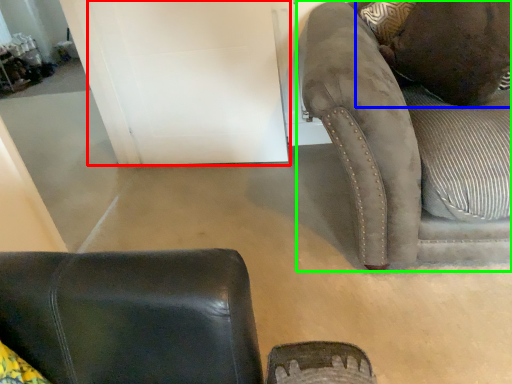
Question: Which object is positioned closest to door (highlighted by a red box)? Select from pillow (highlighted by a blue box) and studio couch (highlighted by a green box).

Choices:
 (A) pillow
 (B) studio couch

Answer: (B)